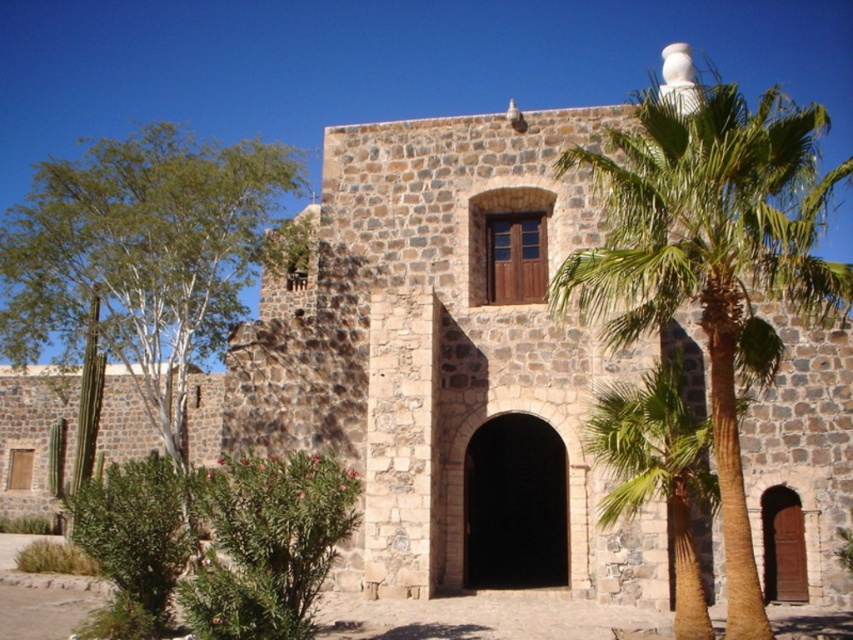
Does green leafy palm tree at upper right appear under green leafy palm tree at center?

Incorrect, green leafy palm tree at upper right is not positioned below green leafy palm tree at center.

Is green leafy palm tree at upper right thinner than green leafy palm tree at center?

Incorrect, green leafy palm tree at upper right's width is not less than green leafy palm tree at center's.

Between point (735, 451) and point (660, 444), which one is positioned behind?

The point (660, 444) is behind.

Find the location of a particular element. This screenshot has width=853, height=640. green leafy palm tree at upper right is located at coordinates (711, 259).

Does green leafy tree at left come behind green leafy palm tree at center?

That is True.

Can you confirm if green leafy tree at left is shorter than green leafy palm tree at center?

Incorrect, green leafy tree at left's height does not fall short of green leafy palm tree at center's.

Between point (82, 209) and point (699, 499), which one is positioned in front?

Point (699, 499)

Locate an element on the screen. This screenshot has height=640, width=853. green leafy tree at left is located at coordinates (144, 257).

From the picture: Can you confirm if green leafy palm tree at upper right is positioned above green leafy tree at left?

Yes.

Can you confirm if green leafy palm tree at upper right is bigger than green leafy tree at left?

Correct, green leafy palm tree at upper right is larger in size than green leafy tree at left.

Between point (851, 305) and point (61, 342), which one is positioned behind?

The point (61, 342) is behind.

The image size is (853, 640). In order to click on green leafy palm tree at upper right in this screenshot , I will do `click(711, 259)`.